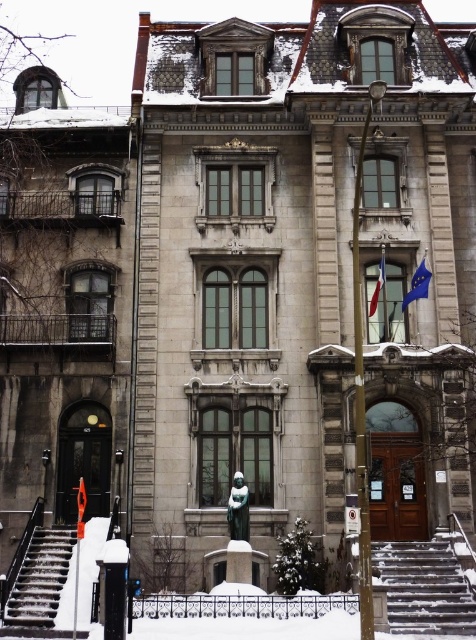
Measure the distance between smooth concrete stairs at lower left and blue fabric flag at upper right.

A distance of 91.37 feet exists between smooth concrete stairs at lower left and blue fabric flag at upper right.

Does smooth concrete stairs at lower left have a larger size compared to blue fabric flag at upper right?

Correct, smooth concrete stairs at lower left is larger in size than blue fabric flag at upper right.

I want to click on smooth concrete stairs at lower left, so click(40, 579).

At what (x,y) coordinates should I click in order to perform the action: click on smooth concrete stairs at lower left. Please return your answer as a coordinate pair (x, y). The height and width of the screenshot is (640, 476). Looking at the image, I should click on (40, 579).

Is smooth concrete stairs at lower left shorter than red fabric flag at center?

Indeed, smooth concrete stairs at lower left has a lesser height compared to red fabric flag at center.

Does smooth concrete stairs at lower left have a greater width compared to red fabric flag at center?

Yes, smooth concrete stairs at lower left is wider than red fabric flag at center.

The image size is (476, 640). I want to click on smooth concrete stairs at lower left, so click(40, 579).

Consider the image. Is snow-covered stone stairs at lower right wider than smooth concrete stairs at lower left?

Yes.

Between snow-covered stone stairs at lower right and smooth concrete stairs at lower left, which one is positioned higher?

Positioned higher is snow-covered stone stairs at lower right.

Is point (413, 589) closer to viewer compared to point (46, 563)?

Yes.

Where is `snow-covered stone stairs at lower right`? The height and width of the screenshot is (640, 476). snow-covered stone stairs at lower right is located at coordinates (425, 588).